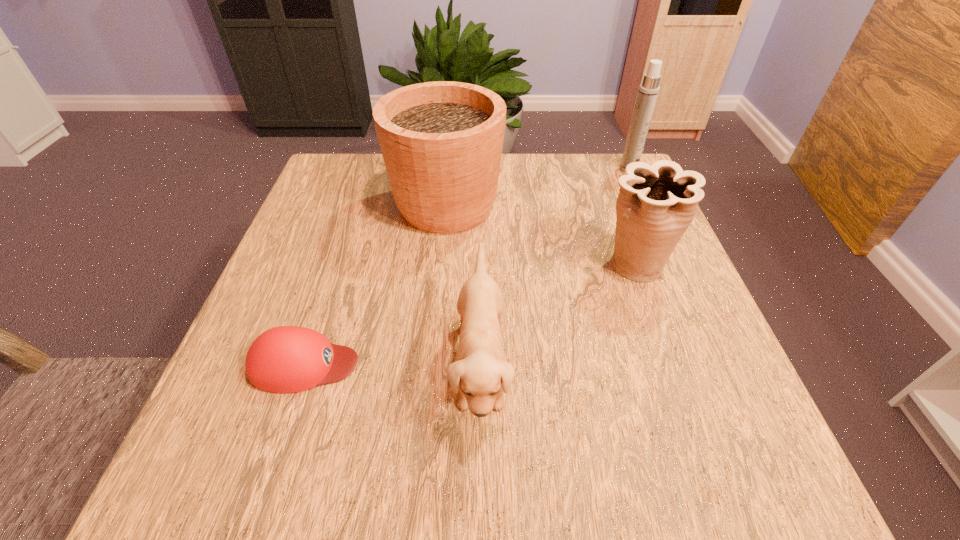
I want to click on vacant space located on the left side of the second shortest object, so click(x=341, y=366).

This screenshot has height=540, width=960. I want to click on vacant space located on the left side of the second shortest object, so click(424, 366).

Image resolution: width=960 pixels, height=540 pixels. Find the location of `free space located 0.050m on the front-facing side of the baseball cap`. free space located 0.050m on the front-facing side of the baseball cap is located at coordinates (389, 364).

I want to click on aerosol can that is at the far edge, so click(x=648, y=91).

Identify the location of flowerpot that is at the far edge. This screenshot has height=540, width=960. (441, 142).

Locate an element on the screen. Image resolution: width=960 pixels, height=540 pixels. object situated at the near edge is located at coordinates (480, 374).

The image size is (960, 540). Identify the location of object that is at the left edge. (288, 359).

The image size is (960, 540). I want to click on aerosol can at the right edge, so click(x=648, y=91).

Locate an element on the screen. The width and height of the screenshot is (960, 540). urn at the right edge is located at coordinates (656, 203).

What are the coordinates of `object that is positioned at the far right corner` in the screenshot? It's located at (648, 91).